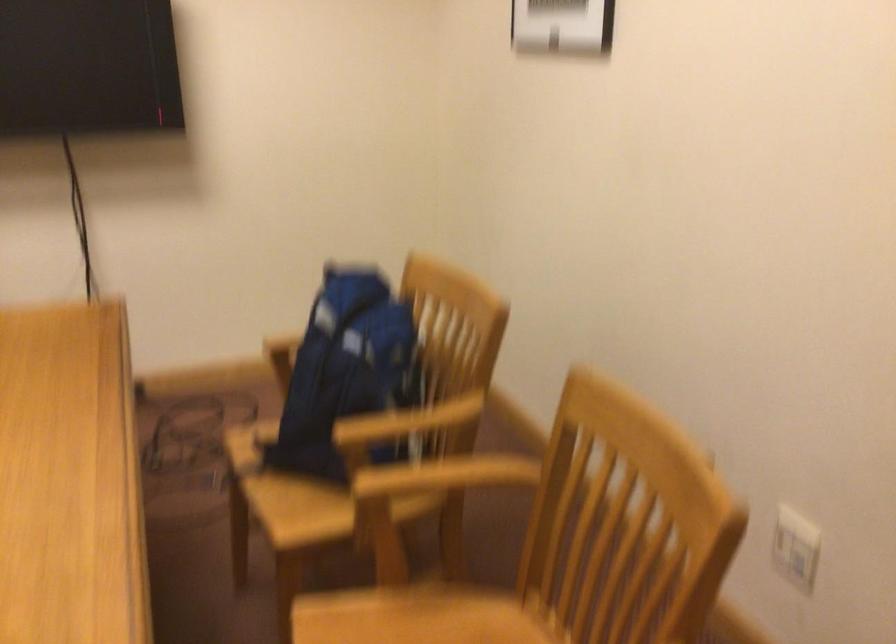
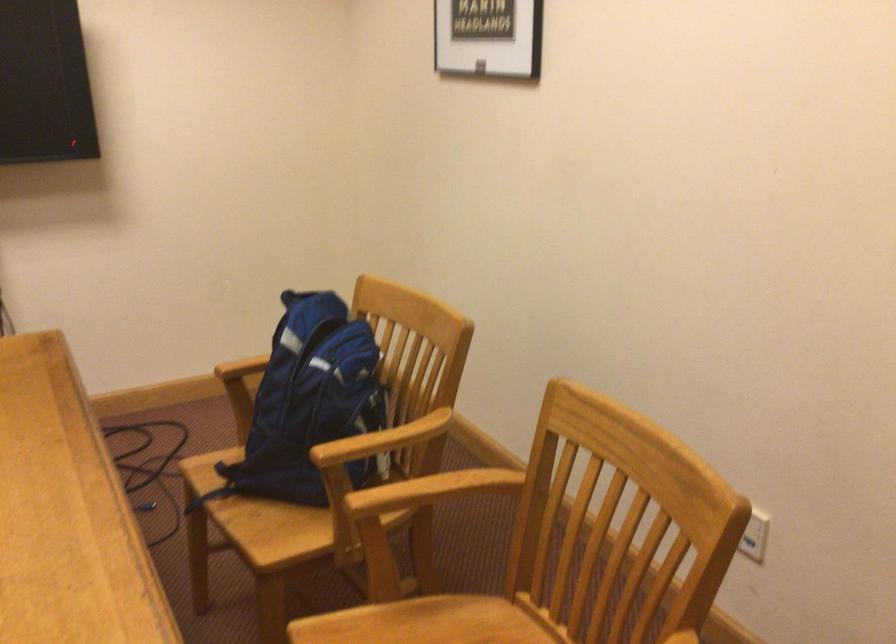
Question: I am providing you with two images of the same scene from different viewpoints. Please identify which objects are invisible in image2.

Choices:
 (A) blue backpack
 (B) wooden chair armrest
 (C) chair sitting surface
 (D) none of these

Answer: (D)